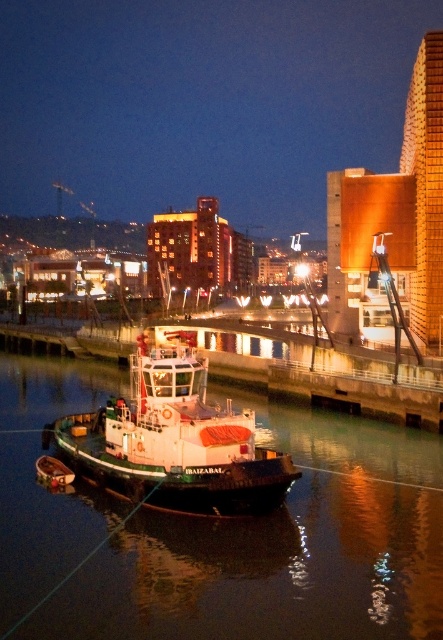
You are standing on the deck of the tugboat IBAIZABAL and notice a point marked at coordinates (221, 531). Where would you find this point in relation to the black rubber water at lower center?

The point at (221, 531) is located on the black rubber water at lower center.

You are standing on the dock and see the black rubber water at lower center and the white matte boat at center. Which object is positioned lower in the image?

The black rubber water at lower center is located below the white matte boat at center, so it is positioned lower in the image.